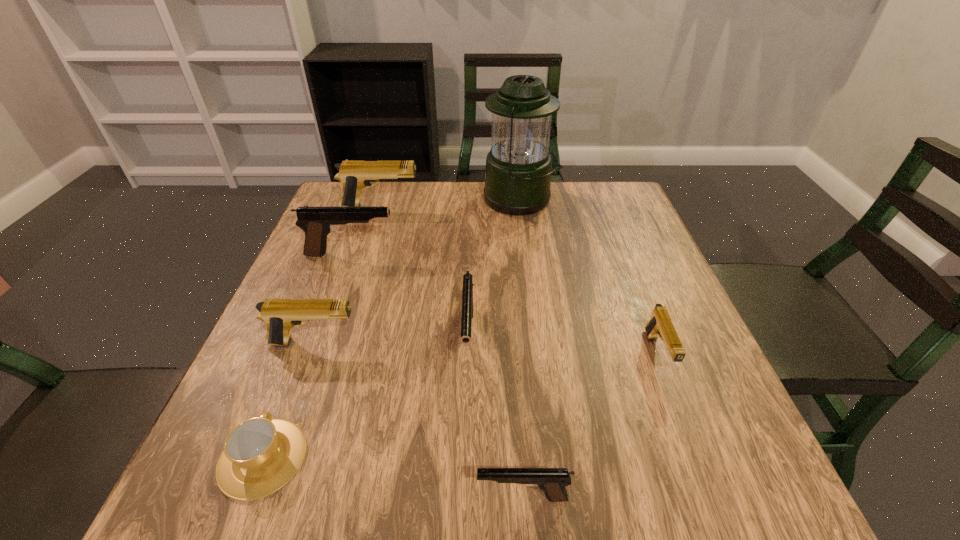
The width and height of the screenshot is (960, 540). In order to click on empty space that is in between the second smallest tan pistol and the leftmost black pistol in this screenshot , I will do `click(332, 299)`.

At what (x,y) coordinates should I click in order to perform the action: click on vacant area that lies between the second biggest tan pistol and the biggest tan pistol. Please return your answer as a coordinate pair (x, y). The image size is (960, 540). Looking at the image, I should click on (347, 275).

Locate an element on the screen. vacant space that's between the nearest pistol and the cup is located at coordinates (393, 478).

The height and width of the screenshot is (540, 960). In order to click on free space between the shortest object and the second biggest tan pistol in this screenshot , I will do `click(288, 401)`.

Where is `vacant space in between the cup and the fifth nearest pistol`? Image resolution: width=960 pixels, height=540 pixels. vacant space in between the cup and the fifth nearest pistol is located at coordinates (306, 356).

Where is `free space between the fifth object from left to right and the second smallest tan pistol`? The height and width of the screenshot is (540, 960). free space between the fifth object from left to right and the second smallest tan pistol is located at coordinates (391, 341).

The width and height of the screenshot is (960, 540). I want to click on free spot between the second biggest tan pistol and the nearest black pistol, so click(418, 421).

Where is `free spot between the second smallest tan pistol and the farthest black pistol`? This screenshot has width=960, height=540. free spot between the second smallest tan pistol and the farthest black pistol is located at coordinates (332, 299).

This screenshot has height=540, width=960. Identify the location of empty space between the second biggest tan pistol and the third pistol from right to left. (391, 341).

In order to click on free space between the tallest object and the farthest pistol in this screenshot , I will do `click(450, 204)`.